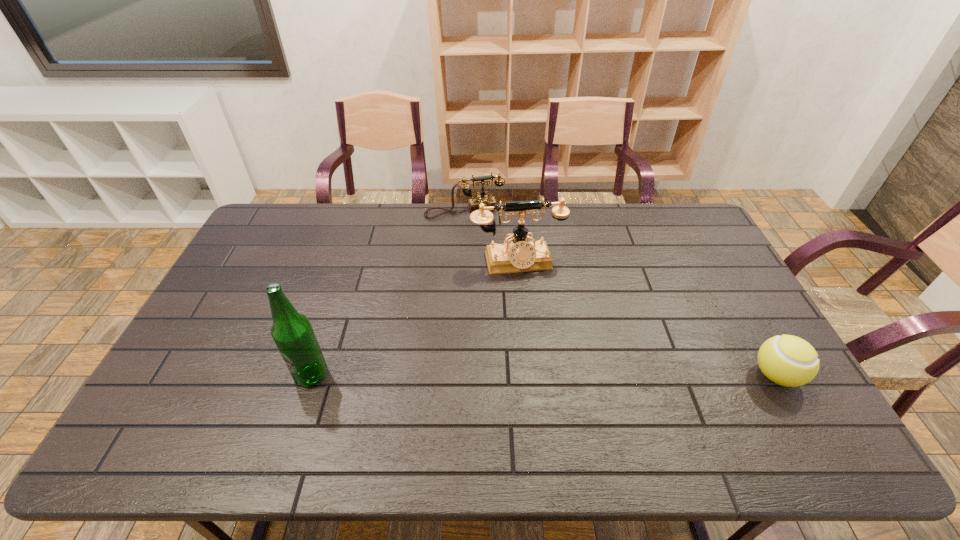
Find the location of a particular element. vacant spot on the desktop that is between the tallest object and the tennis ball and is positioned on the dial of the nearer telephone is located at coordinates (547, 375).

The image size is (960, 540). Identify the location of vacant space on the desktop that is between the tallest object and the rightmost object and is positioned on the front-facing side of the farthest object. (516, 375).